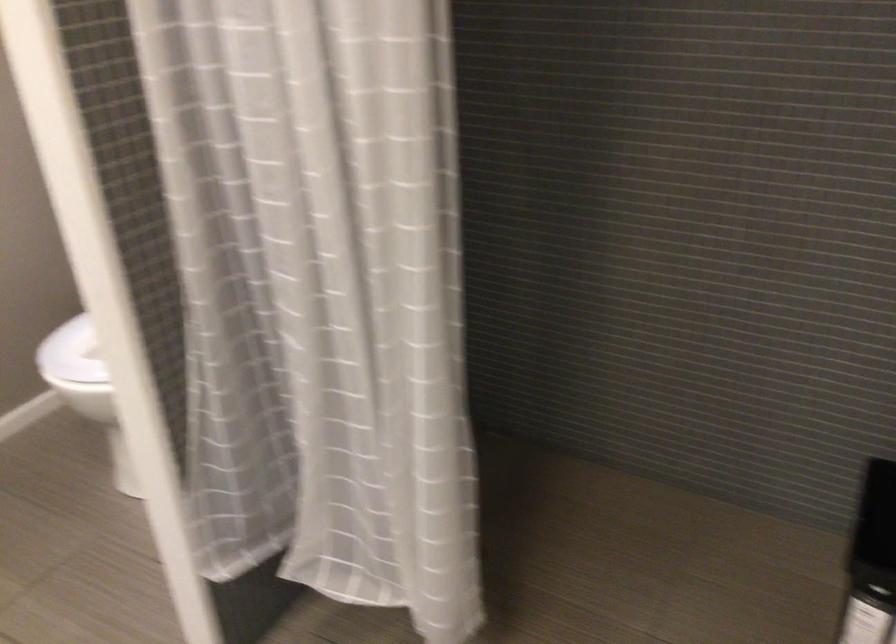
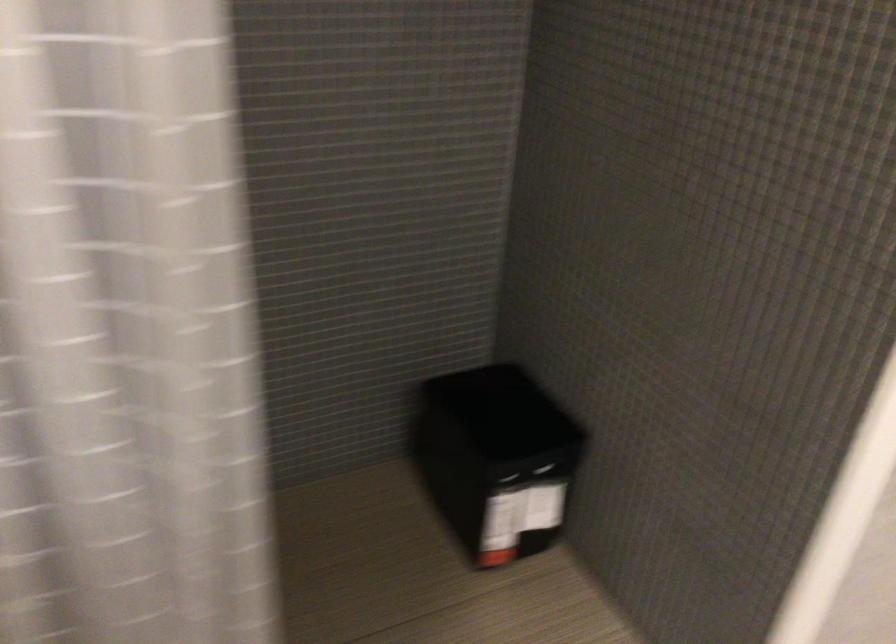
Question: The camera is either moving clockwise (left) or counter-clockwise (right) around the object. The first image is from the beginning of the video and the second image is from the end. Is the camera moving left or right when shooting the video?

Choices:
 (A) Left
 (B) Right

Answer: (A)